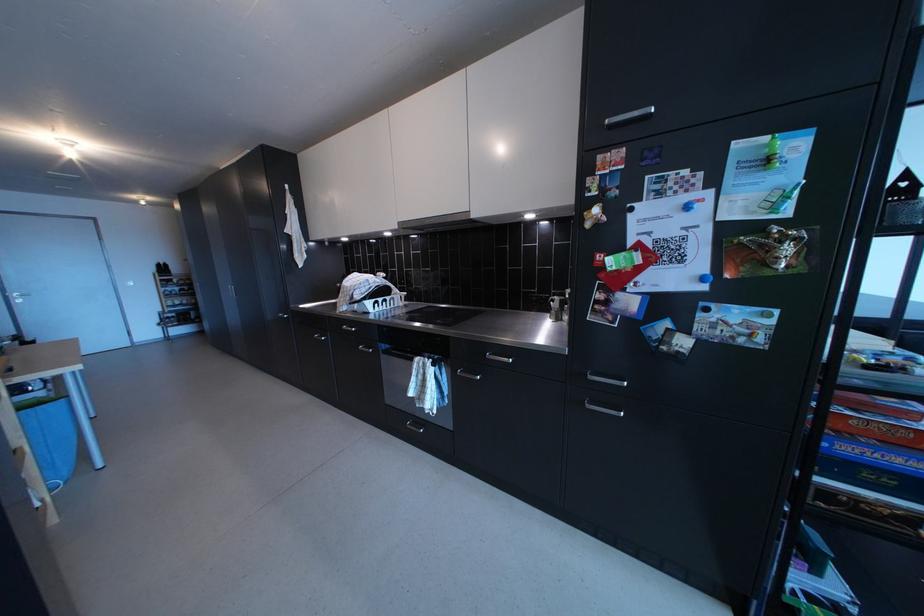
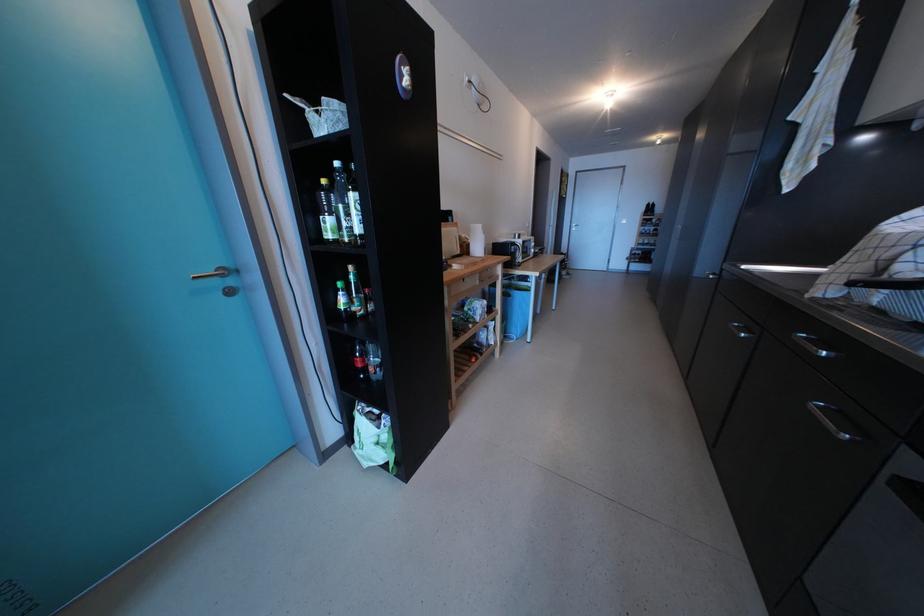
Based on the continuous images, in which direction is the camera rotating?

The rotation direction of the camera is left-down.